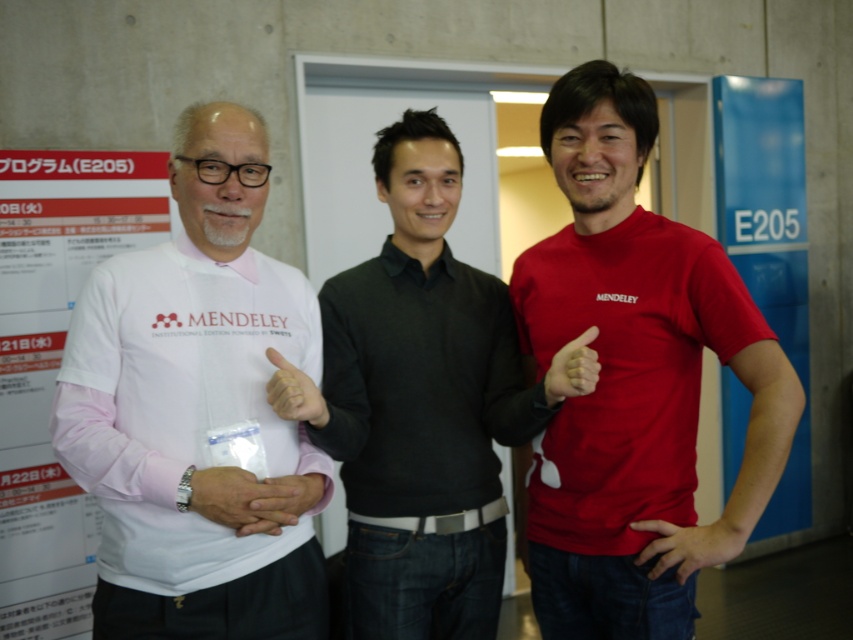
How far apart are white matte shirt at left and white matte hand at center?

A distance of 8.78 inches exists between white matte shirt at left and white matte hand at center.

Which is in front, point (131, 604) or point (308, 476)?

Point (131, 604)

Describe the element at coordinates (193, 406) in the screenshot. The image size is (853, 640). I see `white matte shirt at left` at that location.

Locate an element on the screen. The image size is (853, 640). white matte shirt at left is located at coordinates (193, 406).

Which is more to the right, white paper at left or matte red shirt at center?

matte red shirt at center is more to the right.

How distant is white paper at left from matte red shirt at center?

They are 5.99 feet apart.

Image resolution: width=853 pixels, height=640 pixels. Find the location of `white paper at left`. white paper at left is located at coordinates (55, 364).

In the scene shown: Does white matte shirt at left have a greater width compared to white matte watch at center?

Indeed, white matte shirt at left has a greater width compared to white matte watch at center.

Does white matte shirt at left appear on the right side of white matte watch at center?

In fact, white matte shirt at left is to the left of white matte watch at center.

Which is in front, point (277, 561) or point (260, 502)?

Point (260, 502) is in front.

You are a GUI agent. You are given a task and a screenshot of the screen. Output one action in this format:
    pyautogui.click(x=<x>, y=<y>)
    Task: Click on the white matte shirt at left
    This screenshot has width=853, height=640.
    Given the screenshot: What is the action you would take?
    pyautogui.click(x=193, y=406)